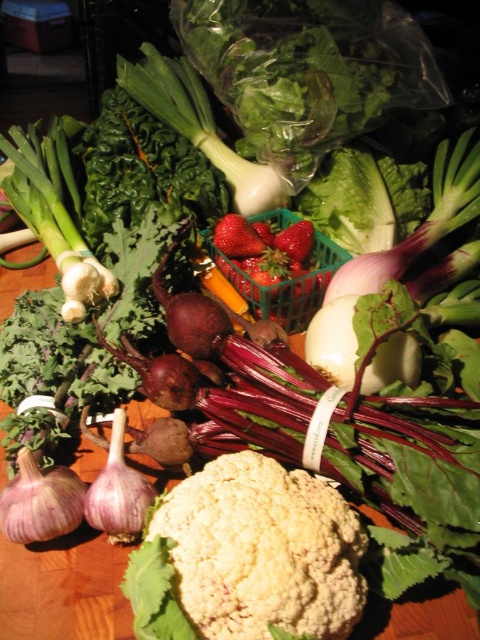
Measure the distance between point [56,525] and camera.

25.66 inches

Can you confirm if purple matte garlic at center is wider than purple matte garlic at lower left?

Correct, the width of purple matte garlic at center exceeds that of purple matte garlic at lower left.

Identify the location of purple matte garlic at center. The height and width of the screenshot is (640, 480). (40, 500).

Locate an element on the screen. green plastic basket at center is located at coordinates (288, 285).

Can you confirm if green plastic basket at center is bigger than red matte strawberries at center?

Yes, green plastic basket at center is bigger than red matte strawberries at center.

Image resolution: width=480 pixels, height=640 pixels. I want to click on green plastic basket at center, so click(x=288, y=285).

At what (x,y) coordinates should I click in order to perform the action: click on green plastic basket at center. Please return your answer as a coordinate pair (x, y). This screenshot has width=480, height=640. Looking at the image, I should click on (288, 285).

Is point (287, 252) behind point (121, 528)?

Yes, it is behind point (121, 528).

Which is more to the left, red matte strawberries at center or purple matte garlic at lower left?

purple matte garlic at lower left is more to the left.

Between point (237, 225) and point (88, 508), which one is positioned behind?

The point (237, 225) is more distant.

Locate an element on the screen. This screenshot has width=480, height=640. red matte strawberries at center is located at coordinates (264, 248).